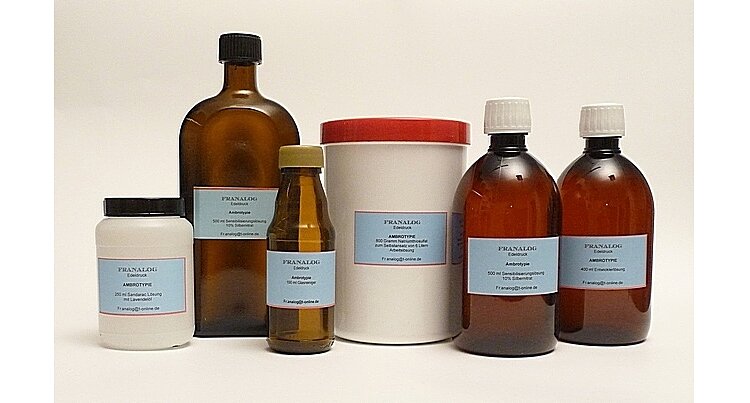
Identify the location of jar. (152, 237).